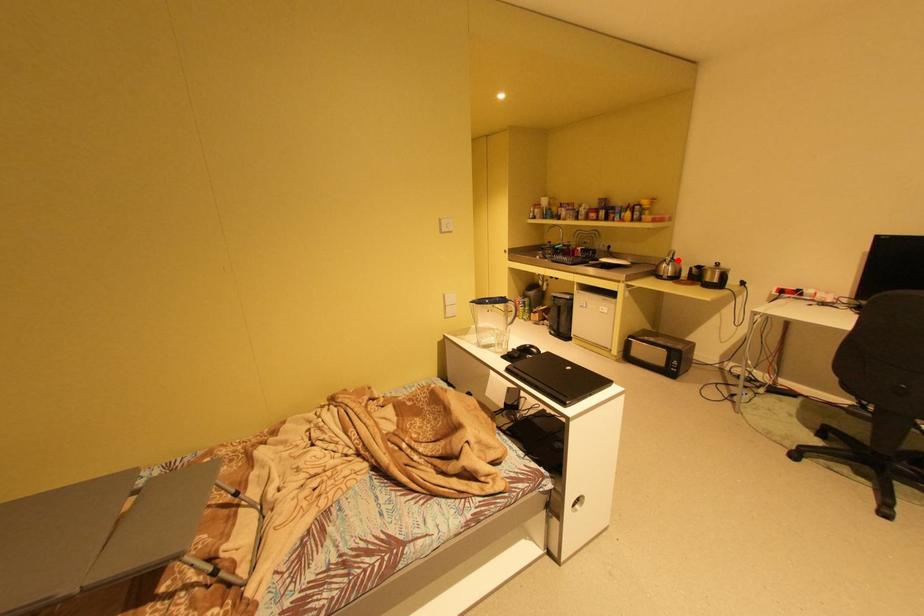
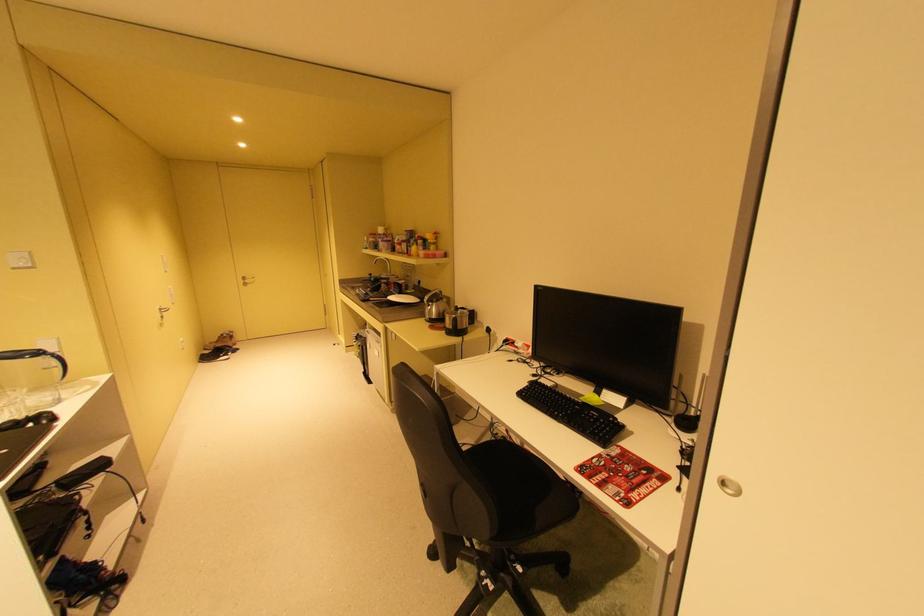
Locate, in the second image, the point that corresponds to the highlighted location in the first image.

(439, 302)